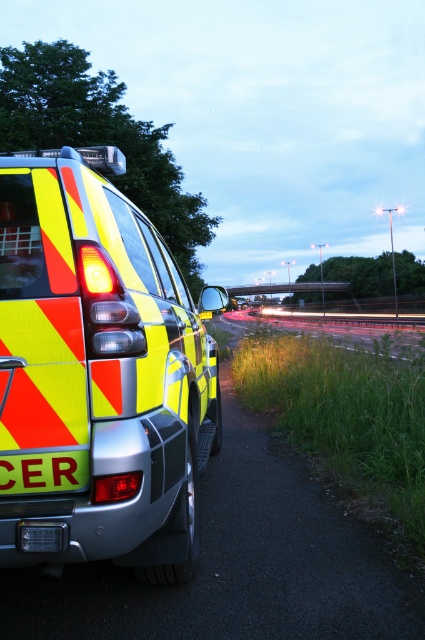
Question: Which object is farther from the camera taking this photo?

Choices:
 (A) yellow reflective sign at lower left
 (B) reflective plastic ambulance at center-left
 (C) metallic asphalt highway at center

Answer: (C)

Question: Based on their relative distances, which object is farther from the yellow reflective sign at lower left?

Choices:
 (A) reflective plastic ambulance at center-left
 (B) metallic asphalt highway at center

Answer: (B)

Question: Does reflective plastic ambulance at center-left have a larger size compared to yellow reflective sign at lower left?

Choices:
 (A) no
 (B) yes

Answer: (B)

Question: Considering the relative positions of reflective plastic ambulance at center-left and yellow reflective sign at lower left in the image provided, where is reflective plastic ambulance at center-left located with respect to yellow reflective sign at lower left?

Choices:
 (A) above
 (B) below

Answer: (A)

Question: Which object appears farthest from the camera in this image?

Choices:
 (A) metallic asphalt highway at center
 (B) yellow reflective sign at lower left
 (C) reflective plastic ambulance at center-left

Answer: (A)

Question: Can you confirm if reflective plastic ambulance at center-left is thinner than yellow reflective sign at lower left?

Choices:
 (A) yes
 (B) no

Answer: (B)